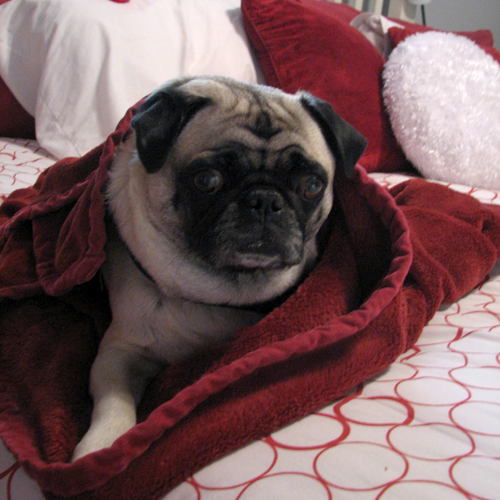
The height and width of the screenshot is (500, 500). I want to click on pillows, so click(x=148, y=58), click(x=314, y=49), click(x=462, y=124).